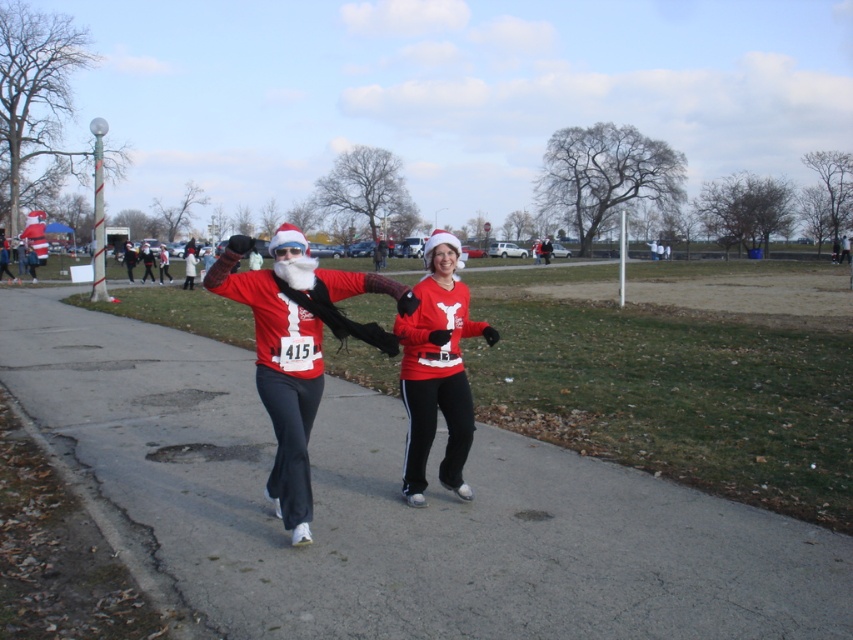
Is smooth asphalt road at center positioned behind matte red sweater at center?

No, smooth asphalt road at center is closer to the viewer.

Does smooth asphalt road at center have a larger size compared to matte red sweater at center?

Correct, smooth asphalt road at center is larger in size than matte red sweater at center.

Does point (195, 518) come behind point (427, 333)?

Yes, it is behind point (427, 333).

Identify the location of smooth asphalt road at center. This screenshot has width=853, height=640. (398, 508).

Can you confirm if smooth asphalt road at center is bigger than matte red santa suit at center?

Yes, smooth asphalt road at center is bigger than matte red santa suit at center.

The image size is (853, 640). Describe the element at coordinates (398, 508) in the screenshot. I see `smooth asphalt road at center` at that location.

This screenshot has height=640, width=853. I want to click on smooth asphalt road at center, so click(x=398, y=508).

Is point (276, 497) positioned after point (450, 468)?

No, it is in front of (450, 468).

How much distance is there between matte red santa suit at center and matte red sweater at center?

36.87 inches

Who is more forward, (x=285, y=504) or (x=393, y=324)?

Positioned in front is point (x=285, y=504).

Locate an element on the screen. matte red santa suit at center is located at coordinates 296,348.